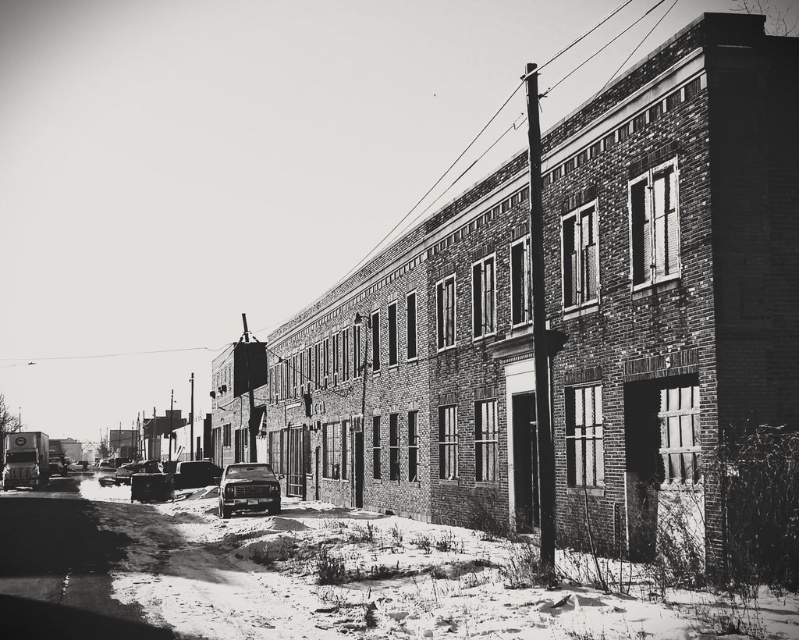
Is shiny black sedan at center below shiny black car at center?

No, shiny black sedan at center is not below shiny black car at center.

Does shiny black sedan at center appear on the left side of shiny black car at center?

No, shiny black sedan at center is not to the left of shiny black car at center.

Is point (253, 472) behind point (201, 481)?

No, (253, 472) is closer to viewer.

Identify the location of shiny black sedan at center. The width and height of the screenshot is (799, 640). (248, 490).